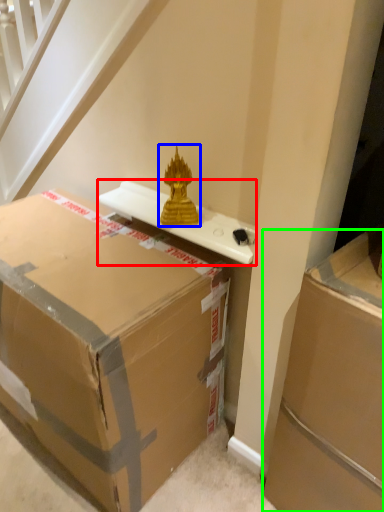
Question: Which object is positioned closest to table (highlighted by a red box)? Select from sculpture (highlighted by a blue box) and box (highlighted by a green box).

Choices:
 (A) sculpture
 (B) box

Answer: (A)